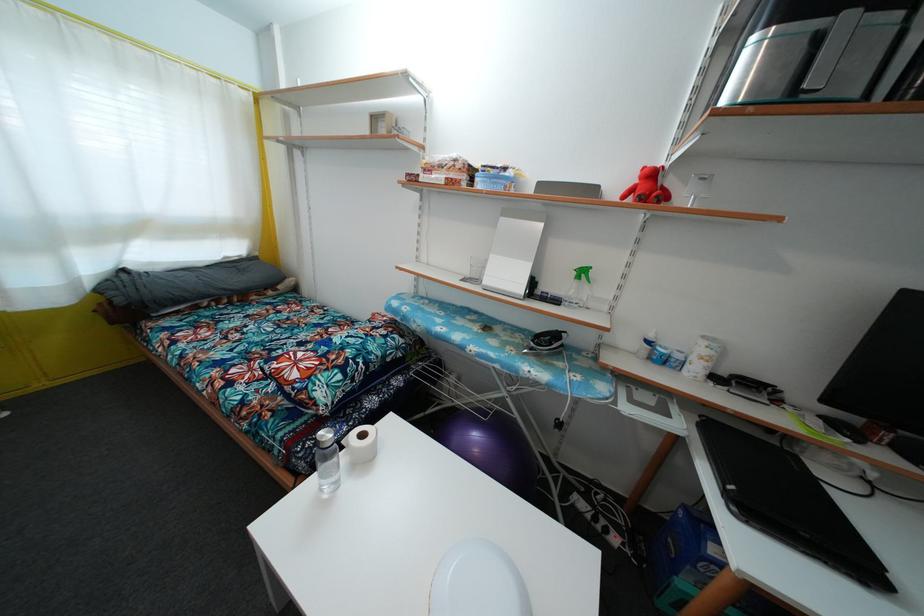
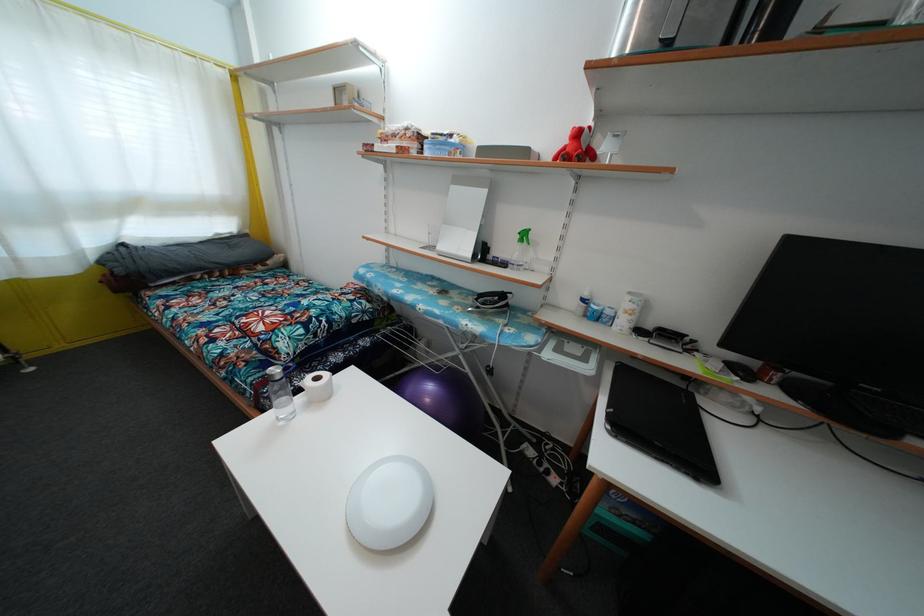
In the second image, find the point that corresponds to [737,516] in the first image.

(613, 434)